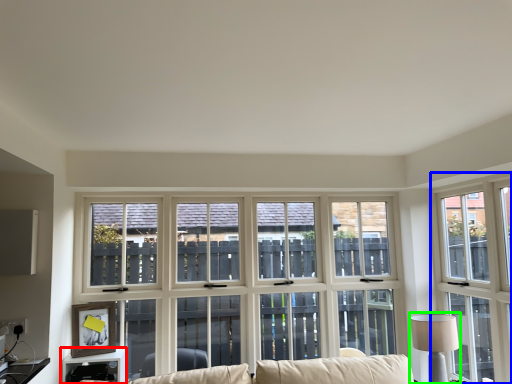
Question: Which object is the farthest from table (highlighted by a red box)? Choose among these: window (highlighted by a blue box) or table lamp (highlighted by a green box).

Choices:
 (A) window
 (B) table lamp

Answer: (A)